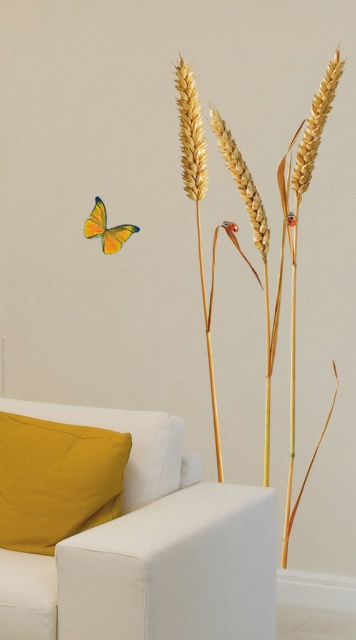
You are arranging flowers in this room and want to place a vase between the mustard fabric pillow at lower left and the dry wheat stalks at center. Based on their positions, which object should the vase be closer to if you want it centered between them?

The mustard fabric pillow at lower left is to the left of dry wheat stalks at center. To center the vase between them, it should be placed equidistant from both objects, but since the pillow is on the left and the wheat is on the right, the vase would naturally be centered between their positions.